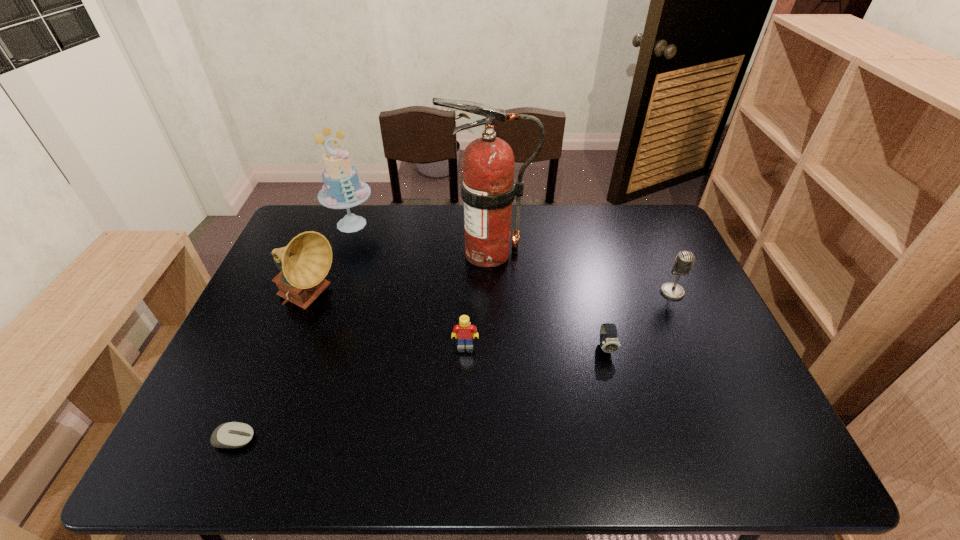
Locate an element on the screen. vacant space in between the computer equipment and the cake is located at coordinates (293, 332).

Locate an element on the screen. vacant area that lies between the second tallest object and the computer equipment is located at coordinates (293, 332).

In order to click on free space between the watch and the fire extinguisher in this screenshot , I will do `click(547, 300)`.

Identify which object is located as the second nearest to the tallest object. Please provide its 2D coordinates. Your answer should be formatted as a tuple, i.e. [(x, y)], where the tuple contains the x and y coordinates of a point satisfying the conditions above.

[(306, 260)]

Identify which object is the second nearest to the watch. Please provide its 2D coordinates. Your answer should be formatted as a tuple, i.e. [(x, y)], where the tuple contains the x and y coordinates of a point satisfying the conditions above.

[(488, 187)]

I want to click on vacant space that satisfies the following two spatial constraints: 1. at the nozzle of the fire extinguisher; 2. on the back side of the microphone, so click(489, 292).

At what (x,y) coordinates should I click in order to perform the action: click on vacant space that satisfies the following two spatial constraints: 1. with a ladder on the side of the cake; 2. on the horn of the fifth shortest object. Please return your answer as a coordinate pair (x, y). Looking at the image, I should click on (324, 300).

I want to click on free space that satisfies the following two spatial constraints: 1. on the face of the sixth tallest object; 2. on the wheel side of the nearest object, so click(630, 439).

Where is `free region that satisfies the following two spatial constraints: 1. at the nozzle of the tallest object; 2. on the right side of the fourth tallest object`? The image size is (960, 540). free region that satisfies the following two spatial constraints: 1. at the nozzle of the tallest object; 2. on the right side of the fourth tallest object is located at coordinates (489, 292).

Where is `vacant region that satisfies the following two spatial constraints: 1. at the nozzle of the fire extinguisher; 2. on the right side of the microphone`? The width and height of the screenshot is (960, 540). vacant region that satisfies the following two spatial constraints: 1. at the nozzle of the fire extinguisher; 2. on the right side of the microphone is located at coordinates (489, 292).